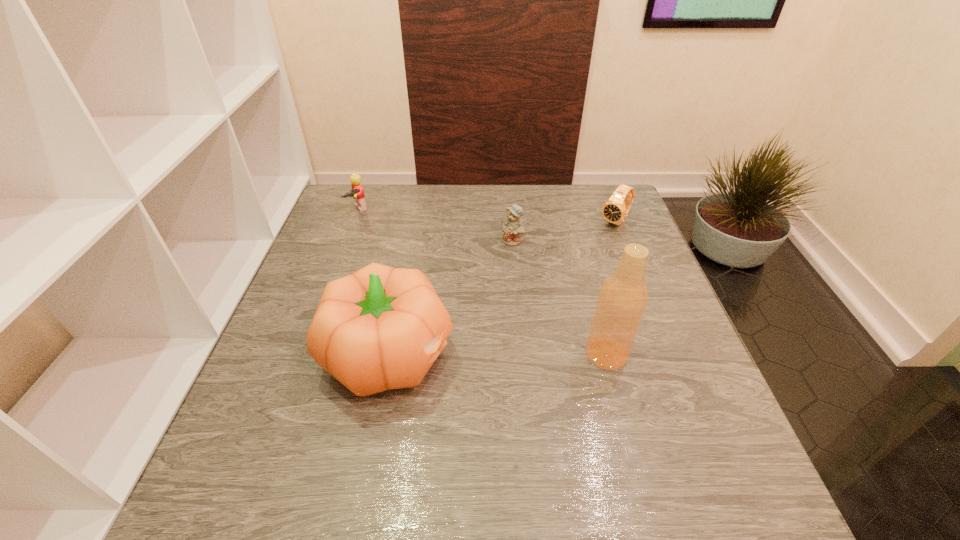
This screenshot has height=540, width=960. What are the coordinates of `watch that is at the far edge` in the screenshot? It's located at (615, 209).

Where is `object that is positioned at the near edge`? Image resolution: width=960 pixels, height=540 pixels. object that is positioned at the near edge is located at coordinates (380, 328).

Locate an element on the screen. This screenshot has height=540, width=960. pumpkin positioned at the left edge is located at coordinates (380, 328).

The image size is (960, 540). I want to click on Lego present at the left edge, so click(x=357, y=193).

This screenshot has height=540, width=960. What are the coordinates of `beer bottle positioned at the right edge` in the screenshot? It's located at (622, 299).

Where is `watch positioned at the right edge`? The image size is (960, 540). watch positioned at the right edge is located at coordinates (615, 209).

The height and width of the screenshot is (540, 960). Identify the location of object at the far left corner. (357, 193).

Find the location of a particular element. Image resolution: width=960 pixels, height=540 pixels. object at the near left corner is located at coordinates (380, 328).

Where is `object situated at the far right corner`? object situated at the far right corner is located at coordinates (615, 209).

In order to click on free location at the far edge in this screenshot , I will do `click(572, 225)`.